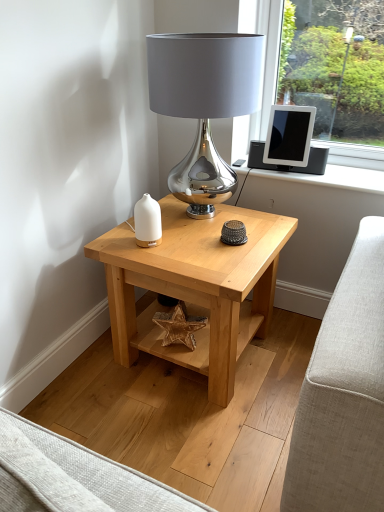
Where is `vacant space underneath satin silver lamp at center (from a real-world perspective)`? This screenshot has width=384, height=512. vacant space underneath satin silver lamp at center (from a real-world perspective) is located at coordinates (200, 218).